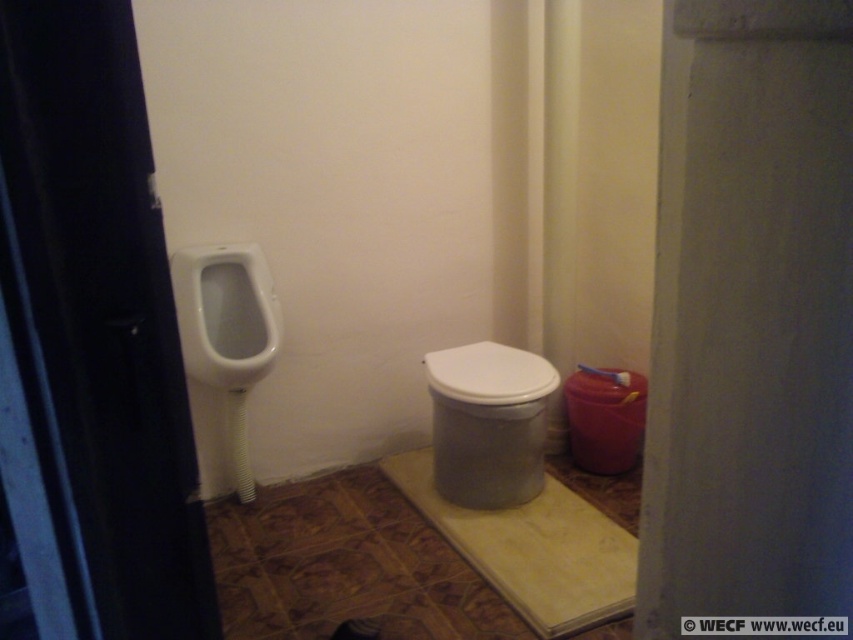
You are standing at the entrance of the bathroom and want to locate the white glossy toilet at center. Based on the coordinates provided, in which direction should you move to reach it?

The white glossy toilet at center is located at coordinates point [488,422]. Since you are at the entrance, you should move towards the center of the bathroom to reach it.

You are standing in the bathroom and want to place a small plant exactly at the point marked as point [488,422]. Based on the scene description, where would this point be located?

The point [488,422] is located on the white glossy toilet at center.

You are a plumber inspecting the bathroom layout. You need to determine if the white glossy toilet at center can be placed under a low ceiling that is only 2.5 meters high. The white glossy urinal at left is already installed and known to be 2.4 meters tall. Can the toilet be placed there without hitting the ceiling?

The white glossy toilet at center is not as tall as the white glossy urinal at left, which is 2.4 meters tall. Since the toilet is shorter, it will not hit the 2.5 meter ceiling.